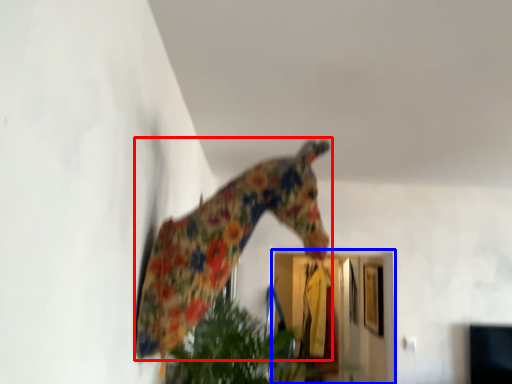
Question: Which of the following is the farthest to the observer, giraffe (highlighted by a red box) or glass door (highlighted by a blue box)?

Choices:
 (A) giraffe
 (B) glass door

Answer: (B)